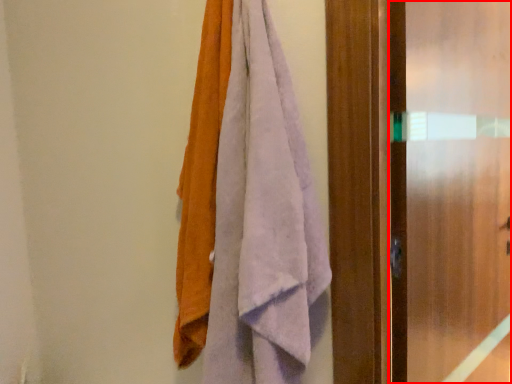
Question: From the image's perspective, what is the correct spatial relationship of screen door (annotated by the red box) in relation to towel?

Choices:
 (A) above
 (B) below

Answer: (B)